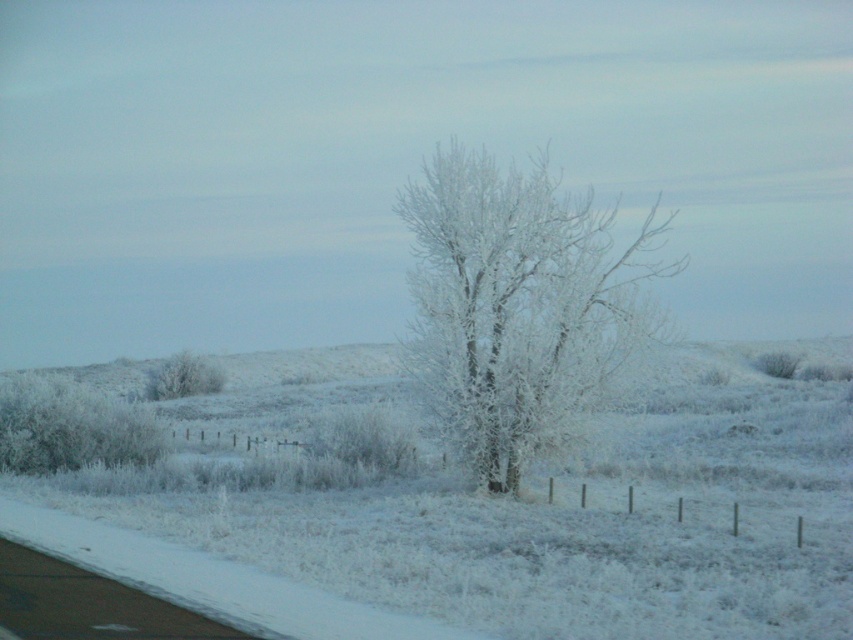
Question: Which object is closer to the camera taking this photo?

Choices:
 (A) frosted white tree at center
 (B) frosted white tree at left

Answer: (A)

Question: Can you confirm if white frosty tree at center is wider than frosted white tree at center?

Choices:
 (A) yes
 (B) no

Answer: (A)

Question: Is white frosty tree at center above frosted white tree at left?

Choices:
 (A) no
 (B) yes

Answer: (B)

Question: Which point appears closest to the camera in this image?

Choices:
 (A) (221, 385)
 (B) (662, 634)

Answer: (B)

Question: Which object appears closest to the camera in this image?

Choices:
 (A) white frosty tree at center
 (B) frosted white tree at left
 (C) frosted white tree at center

Answer: (A)

Question: Can you confirm if white frosty tree at center is thinner than frosted white tree at center?

Choices:
 (A) yes
 (B) no

Answer: (B)